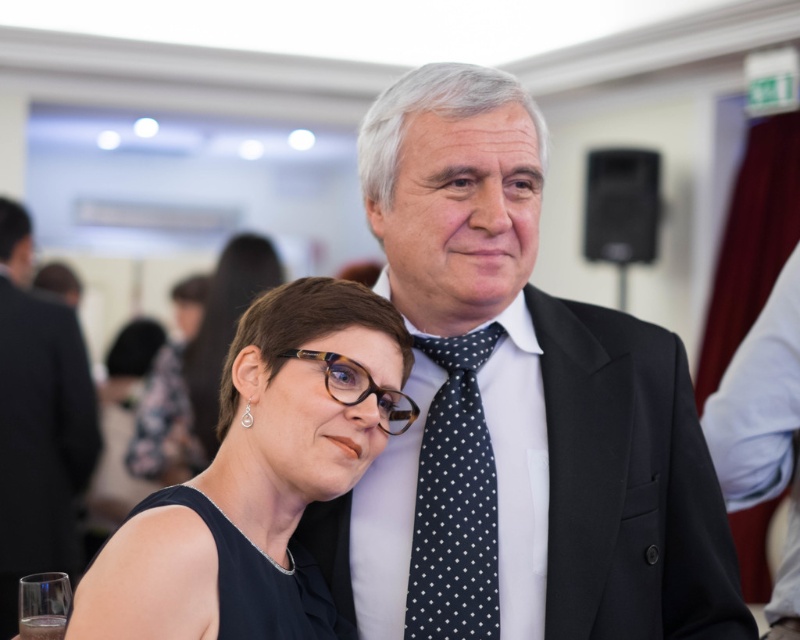
Based on the photo, is polka dot tie at center below dark blue dotted tie at center?

Incorrect, polka dot tie at center is not positioned below dark blue dotted tie at center.

Does polka dot tie at center come in front of dark blue dotted tie at center?

Yes, it is in front of dark blue dotted tie at center.

Who is more distant from viewer, (690,515) or (441,560)?

Point (690,515)

Where is `polka dot tie at center`? polka dot tie at center is located at coordinates (516, 412).

Is dark blue dotted tie at center smaller than white polka dot tie at right?

Yes.

Between dark blue dotted tie at center and white polka dot tie at right, which one has less height?

Standing shorter between the two is dark blue dotted tie at center.

Which is in front, point (432, 404) or point (786, 445)?

Positioned in front is point (432, 404).

Where is `dark blue dotted tie at center`? dark blue dotted tie at center is located at coordinates (454, 500).

Does polka dot tie at center appear on the right side of white polka dot tie at right?

Incorrect, polka dot tie at center is not on the right side of white polka dot tie at right.

Based on the photo, does polka dot tie at center have a larger size compared to white polka dot tie at right?

Yes, polka dot tie at center is bigger than white polka dot tie at right.

At what (x,y) coordinates should I click in order to perform the action: click on polka dot tie at center. Please return your answer as a coordinate pair (x, y). Looking at the image, I should click on (516, 412).